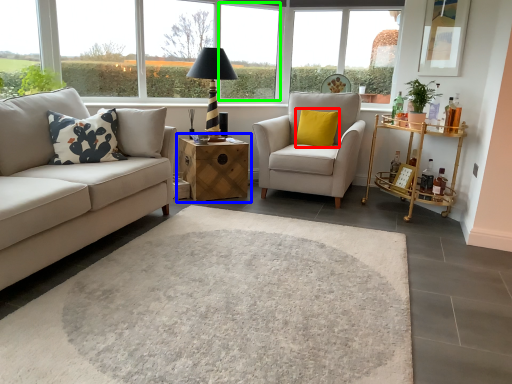
Question: Which is farther away from pillow (highlighted by a red box)? table (highlighted by a blue box) or window frame (highlighted by a green box)?

Choices:
 (A) table
 (B) window frame

Answer: (B)